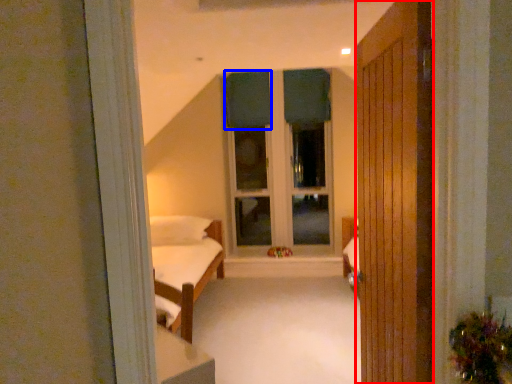
Question: Which of the following is the farthest to the observer, door (highlighted by a red box) or curtain (highlighted by a blue box)?

Choices:
 (A) door
 (B) curtain

Answer: (B)